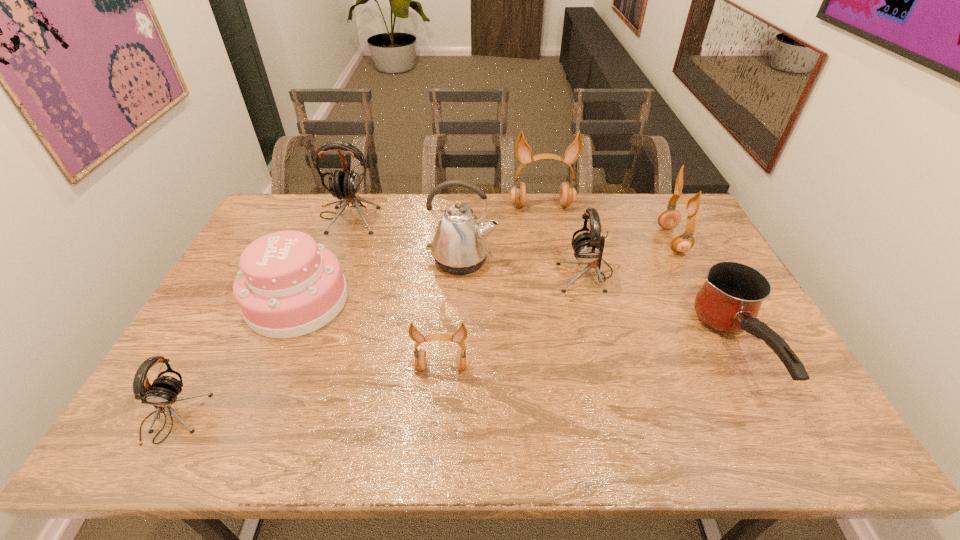
The height and width of the screenshot is (540, 960). In order to click on vacant region between the kettle and the birthday cake in this screenshot , I will do tap(380, 280).

The image size is (960, 540). In order to click on free space between the saucepan and the farthest black earphone in this screenshot , I will do `click(541, 284)`.

Identify the location of empty space that is in between the second smallest brown earphone and the nearest black earphone. The image size is (960, 540). (422, 329).

Find the location of `free point between the second black earphone from left to right and the rightmost brown earphone`. free point between the second black earphone from left to right and the rightmost brown earphone is located at coordinates (510, 228).

Locate an element on the screen. This screenshot has width=960, height=540. vacant region between the smallest black earphone and the biggest brown earphone is located at coordinates (357, 312).

You are a GUI agent. You are given a task and a screenshot of the screen. Output one action in this format:
    pyautogui.click(x=<x>, y=<y>)
    Task: Click on the free spot between the rightmost earphone and the nearest earphone
    The image size is (960, 540).
    Given the screenshot: What is the action you would take?
    pyautogui.click(x=422, y=329)

Find the location of a particular element. This screenshot has width=960, height=540. blank region between the second smallest brown earphone and the second smallest black earphone is located at coordinates (629, 256).

Where is `free space that is in between the saucepan and the leftmost black earphone`? Image resolution: width=960 pixels, height=540 pixels. free space that is in between the saucepan and the leftmost black earphone is located at coordinates (454, 384).

Find the location of `object that is the fourth closest one to the saucepan`. object that is the fourth closest one to the saucepan is located at coordinates (460, 246).

Choose which object is the nearest neighbor to the rightmost earphone. Please provide its 2D coordinates. Your answer should be formatted as a tuple, i.e. [(x, y)], where the tuple contains the x and y coordinates of a point satisfying the conditions above.

[(729, 301)]